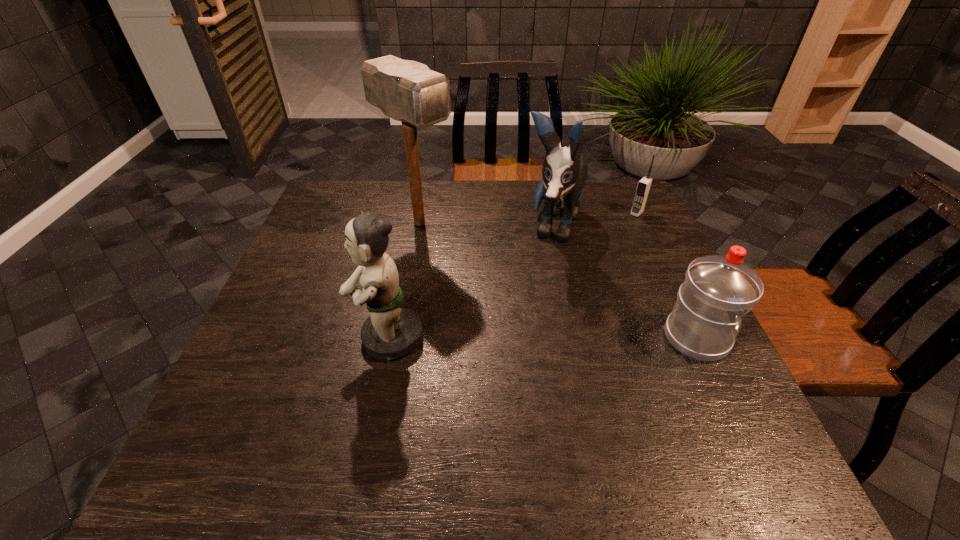
I want to click on vacant area that lies between the cellular telephone and the figurine, so click(513, 275).

Locate an element on the screen. This screenshot has height=540, width=960. unoccupied area between the mallet and the second tallest object is located at coordinates (486, 225).

Identify the location of free point between the second tallest object and the water bottle. (624, 282).

The width and height of the screenshot is (960, 540). Identify the location of unoccupied area between the shortest object and the mallet. (528, 218).

Where is `empty location between the third object from right to left and the fourth tallest object`? The height and width of the screenshot is (540, 960). empty location between the third object from right to left and the fourth tallest object is located at coordinates (624, 282).

At what (x,y) coordinates should I click in order to perform the action: click on vacant space in between the figurine and the mallet. Please return your answer as a coordinate pair (x, y). The width and height of the screenshot is (960, 540). Looking at the image, I should click on (404, 280).

Locate an element on the screen. The height and width of the screenshot is (540, 960). blank region between the mallet and the puppy is located at coordinates (486, 225).

At what (x,y) coordinates should I click in order to perform the action: click on free space between the mallet and the shortest object. Please return your answer as a coordinate pair (x, y). The width and height of the screenshot is (960, 540). Looking at the image, I should click on (528, 218).

Where is `free point between the mallet and the water bottle`? free point between the mallet and the water bottle is located at coordinates (558, 280).

This screenshot has height=540, width=960. Find the location of `vacant area that lies between the puppy and the mallet`. vacant area that lies between the puppy and the mallet is located at coordinates (486, 225).